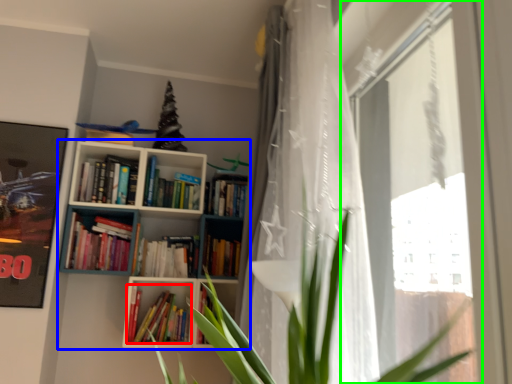
Question: Which is nearer to the book (highlighted by a red box)? bookcase (highlighted by a blue box) or window (highlighted by a green box).

Choices:
 (A) bookcase
 (B) window

Answer: (A)